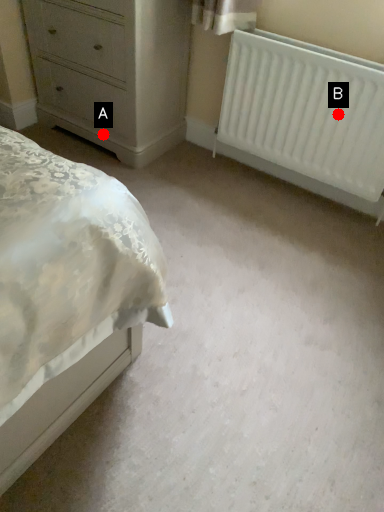
Question: Two points are circled on the image, labeled by A and B beside each circle. Which point appears closest to the camera in this image?

Choices:
 (A) A is closer
 (B) B is closer

Answer: (B)